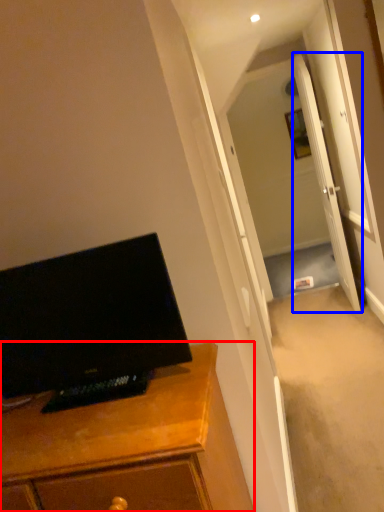
Question: Which point is closer to the camera, cabinetry (highlighted by a red box) or door (highlighted by a blue box)?

Choices:
 (A) cabinetry
 (B) door

Answer: (A)